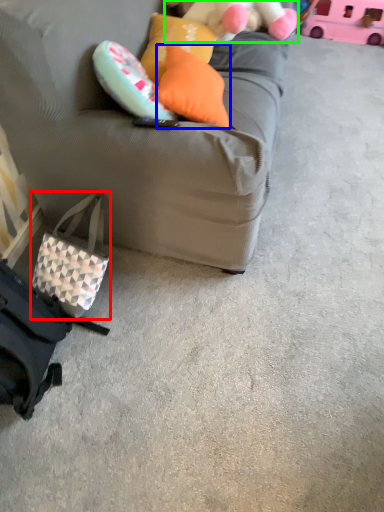
Question: Which object is positioned closest to pouch (highlighted by a red box)? Select from pillow (highlighted by a blue box) and teddy (highlighted by a green box).

Choices:
 (A) pillow
 (B) teddy

Answer: (A)